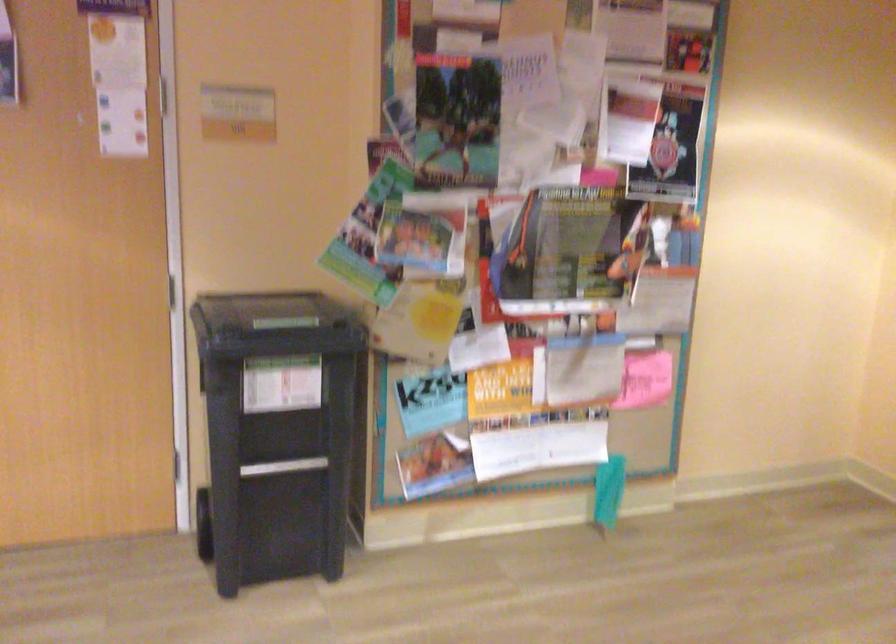
Question: The camera is either moving clockwise (left) or counter-clockwise (right) around the object. The first image is from the beginning of the video and the second image is from the end. Is the camera moving left or right when shooting the video?

Choices:
 (A) Left
 (B) Right

Answer: (A)